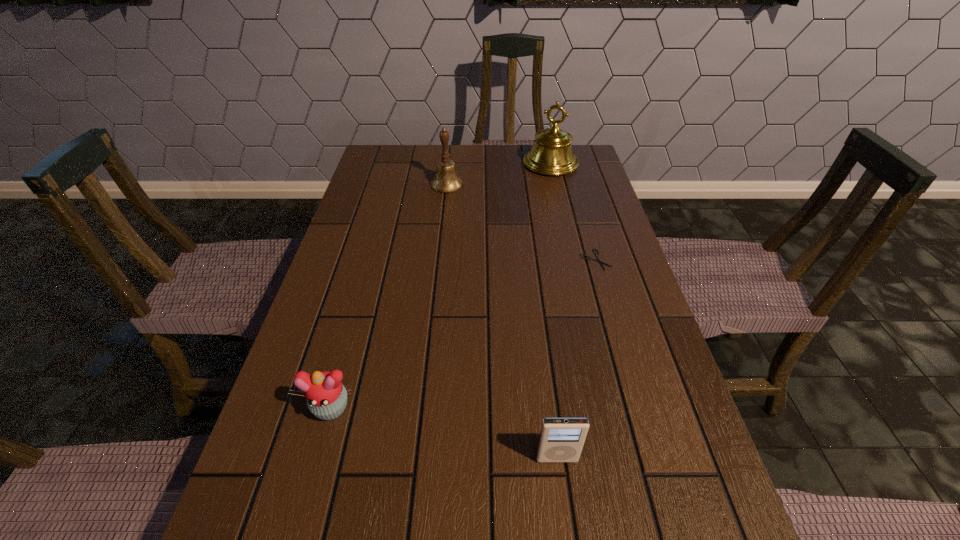
Where is `object that is the fourth nearest to the right bell`? This screenshot has width=960, height=540. object that is the fourth nearest to the right bell is located at coordinates pos(561,439).

Identify the location of object identified as the closest to the nearest object. The height and width of the screenshot is (540, 960). (326, 396).